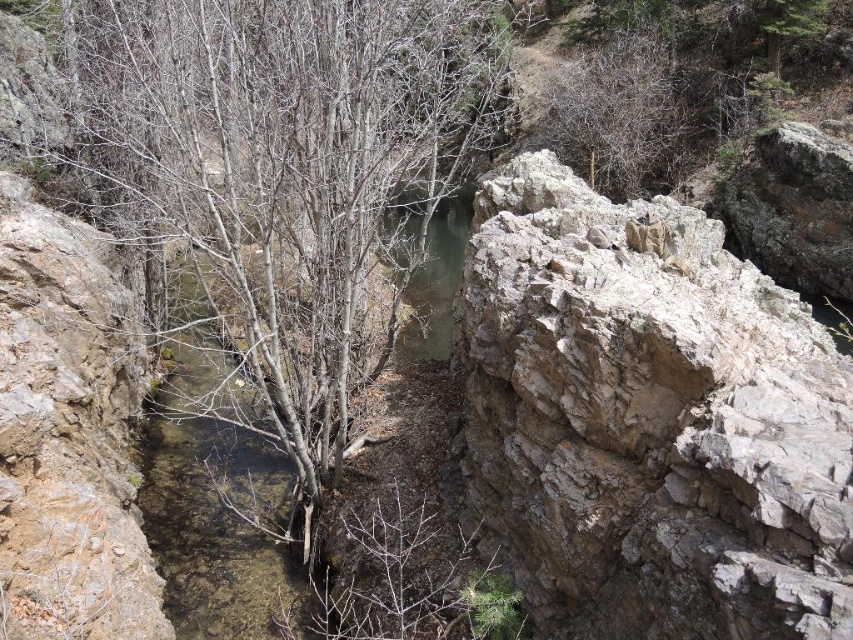
You are standing at the origin point of the coordinate system in the image. You want to move towards the gray rough rock at center right. What are the coordinates you need to move towards?

Answer: You need to move towards the coordinates point (648,422) to reach the gray rough rock at center right.

You are a hiker trying to cross the stream in the rocky landscape. You see a smooth bark tree at center and clear water at center. Which object is wider so you can decide where to step?

The smooth bark tree at center is wider than the clear water at center. Therefore, stepping near the smooth bark tree at center would provide a wider area to step compared to the clear water at center.

You are standing at a viewpoint overlooking the rocky landscape. You notice two points marked on the image, one at coordinates point (473, 483) and the other at point (469, 156). Which point is nearer to your current position?

Point (473, 483) is closer to the viewer than point (469, 156), so the point at coordinates point (473, 483) is nearer to your current position.